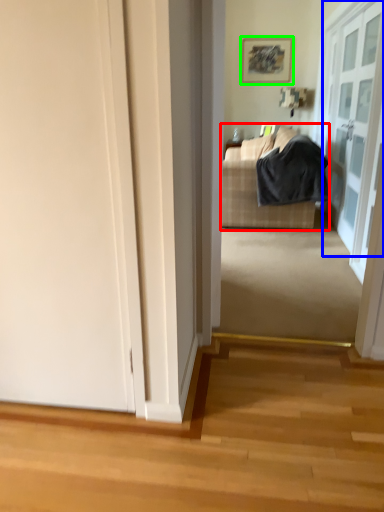
Question: Based on their relative distances, which object is nearer to studio couch (highlighted by a red box)? Choose from door (highlighted by a blue box) and picture frame (highlighted by a green box).

Choices:
 (A) door
 (B) picture frame

Answer: (A)